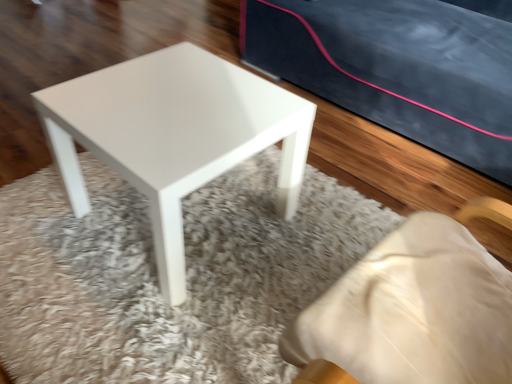
Question: Is matte black mat at upper center in front of or behind white glossy stool at center in the image?

Choices:
 (A) behind
 (B) front

Answer: (B)

Question: Considering the positions of matte black mat at upper center and white glossy stool at center in the image, is matte black mat at upper center bigger or smaller than white glossy stool at center?

Choices:
 (A) big
 (B) small

Answer: (A)

Question: Considering the relative positions of matte black mat at upper center and white glossy stool at center in the image provided, is matte black mat at upper center to the left or to the right of white glossy stool at center?

Choices:
 (A) left
 (B) right

Answer: (B)

Question: Is white glossy stool at center to the left or to the right of matte black mat at upper center in the image?

Choices:
 (A) right
 (B) left

Answer: (B)

Question: Considering the positions of white glossy stool at center and matte black mat at upper center in the image, is white glossy stool at center bigger or smaller than matte black mat at upper center?

Choices:
 (A) big
 (B) small

Answer: (B)

Question: From the image's perspective, is white glossy stool at center positioned above or below matte black mat at upper center?

Choices:
 (A) above
 (B) below

Answer: (A)

Question: Considering the positions of white glossy stool at center and matte black mat at upper center in the image, is white glossy stool at center wider or thinner than matte black mat at upper center?

Choices:
 (A) thin
 (B) wide

Answer: (A)